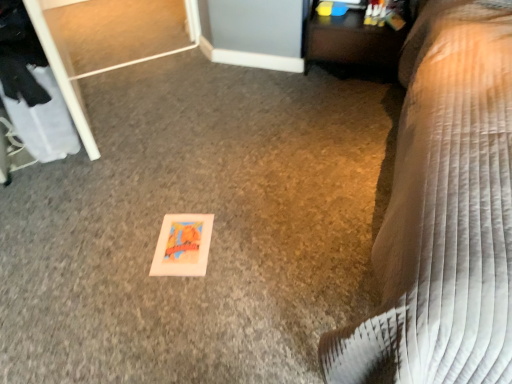
Question: In terms of size, does brown quilted bedspread at lower right appear bigger or smaller than wooden table at upper right?

Choices:
 (A) big
 (B) small

Answer: (A)

Question: Visually, is brown quilted bedspread at lower right positioned to the left or to the right of wooden table at upper right?

Choices:
 (A) right
 (B) left

Answer: (A)

Question: From a real-world perspective, is brown quilted bedspread at lower right physically located above or below wooden table at upper right?

Choices:
 (A) below
 (B) above

Answer: (B)

Question: Looking at the image, does wooden table at upper right seem bigger or smaller compared to brown quilted bedspread at lower right?

Choices:
 (A) small
 (B) big

Answer: (A)

Question: Is wooden table at upper right wider or thinner than brown quilted bedspread at lower right?

Choices:
 (A) thin
 (B) wide

Answer: (A)

Question: In terms of height, does wooden table at upper right look taller or shorter compared to brown quilted bedspread at lower right?

Choices:
 (A) tall
 (B) short

Answer: (B)

Question: From the image's perspective, is wooden table at upper right above or below brown quilted bedspread at lower right?

Choices:
 (A) below
 (B) above

Answer: (B)